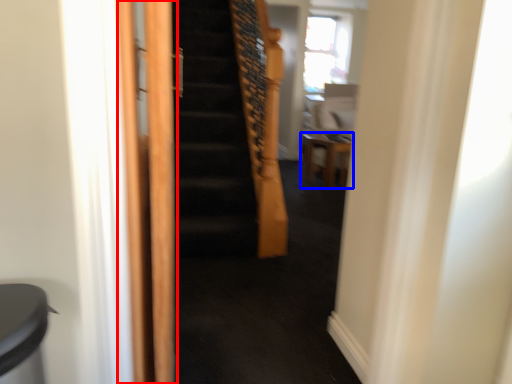
Question: Which object appears closest to the camera in this image, screen door (highlighted by a red box) or furniture (highlighted by a blue box)?

Choices:
 (A) screen door
 (B) furniture

Answer: (A)